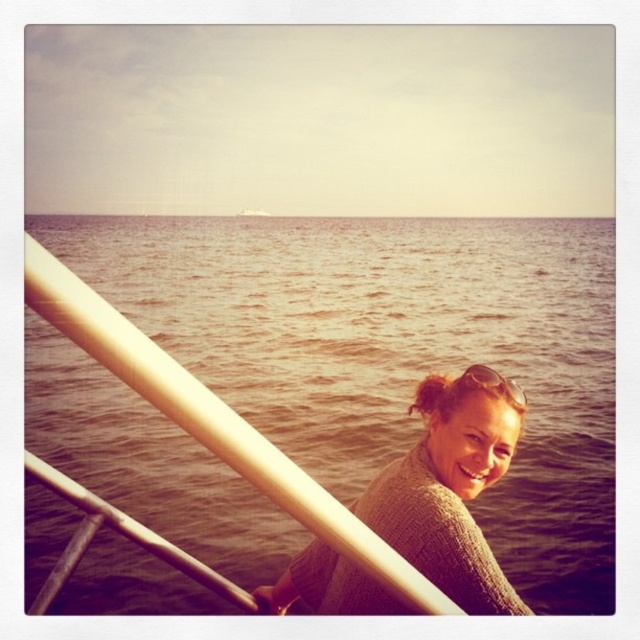
You are standing on a beach and looking at the scene. You see the brown water at center and the sunglasses at center. Which object is closer to you?

The sunglasses at center are closer to you because the brown water at center is located above them, meaning the sunglasses are positioned lower in the scene and thus nearer to your viewpoint.

You are packing your bag for a beach day and have both the knitted sweater at center and sunglasses at center. Which item should you place first into your bag to save space?

The knitted sweater at center is larger in size than sunglasses at center, so you should place the knitted sweater at center first to save space.